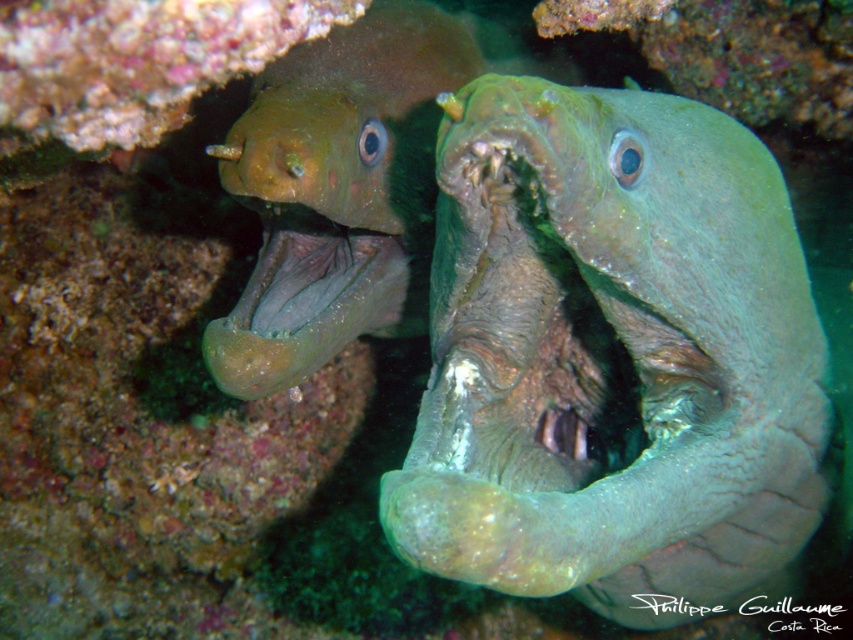
Question: Which of the following is the closest to the observer?

Choices:
 (A) green rough skin at center
 (B) green matte moray eel at upper left

Answer: (A)

Question: Which point is closer to the camera taking this photo?

Choices:
 (A) (433, 394)
 (B) (260, 205)

Answer: (A)

Question: Which point is closer to the camera?

Choices:
 (A) (262, 204)
 (B) (579, 296)

Answer: (B)

Question: Can you confirm if green rough skin at center is thinner than green matte moray eel at upper left?

Choices:
 (A) yes
 (B) no

Answer: (B)

Question: Is green rough skin at center in front of green matte moray eel at upper left?

Choices:
 (A) no
 (B) yes

Answer: (B)

Question: Is green rough skin at center positioned in front of green matte moray eel at upper left?

Choices:
 (A) no
 (B) yes

Answer: (B)